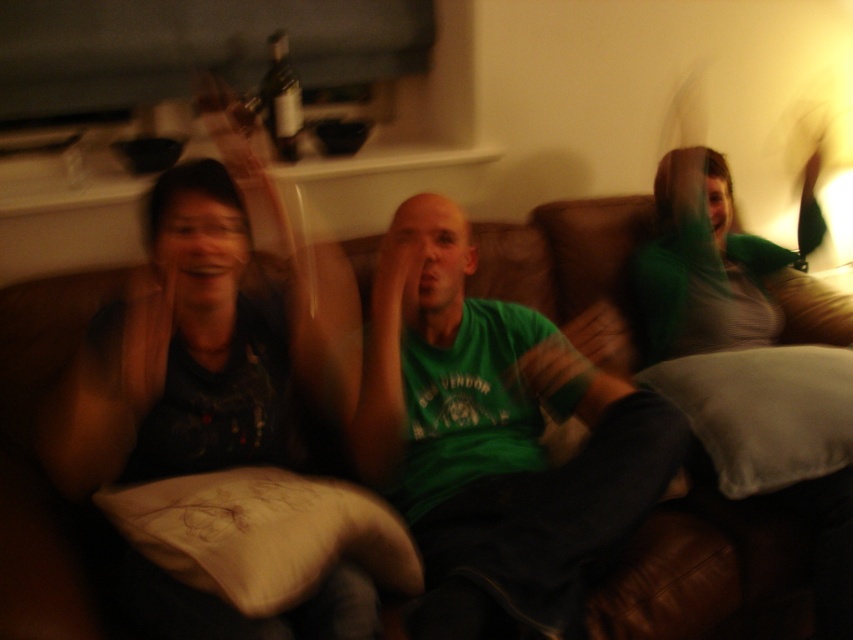
You are a furniture designer who wants to place a new decorative item on the brown leather couch at center and the white soft pillow at lower left. Considering their sizes, which one can accommodate a larger decorative item?

The brown leather couch at center is larger in size than the white soft pillow at lower left, so it can accommodate a larger decorative item.

You are a photographer setting up a shot of the living room scene. You need to ensure that the green matte shirt at center and the white soft pillow at lower left are both visible in the frame. Given their height difference, which object might require you to adjust your camera angle to capture both properly?

The green matte shirt at center is much taller than the white soft pillow at lower left. To ensure both are visible, you might need to angle the camera downward to capture the taller green matte shirt at center while still including the shorter white soft pillow at lower left in the frame.

You are a furniture designer trying to place a new sofa in a living room. You have a brown leather couch at center and a white soft pillow at lower left. Which object has a smaller width?

The brown leather couch at center has a lesser width compared to the white soft pillow at lower left, so the brown leather couch at center is smaller in width.